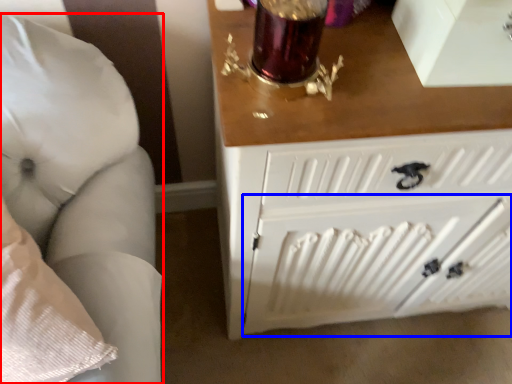
Question: Which object is closer to the camera taking this photo, furniture (highlighted by a red box) or radiator (highlighted by a blue box)?

Choices:
 (A) furniture
 (B) radiator

Answer: (A)